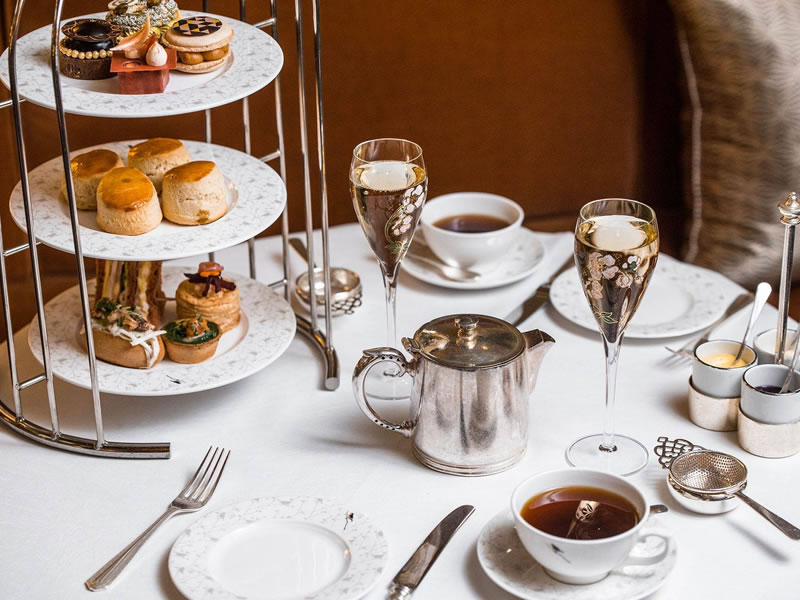
The width and height of the screenshot is (800, 600). Identify the location of glass. (610, 264).